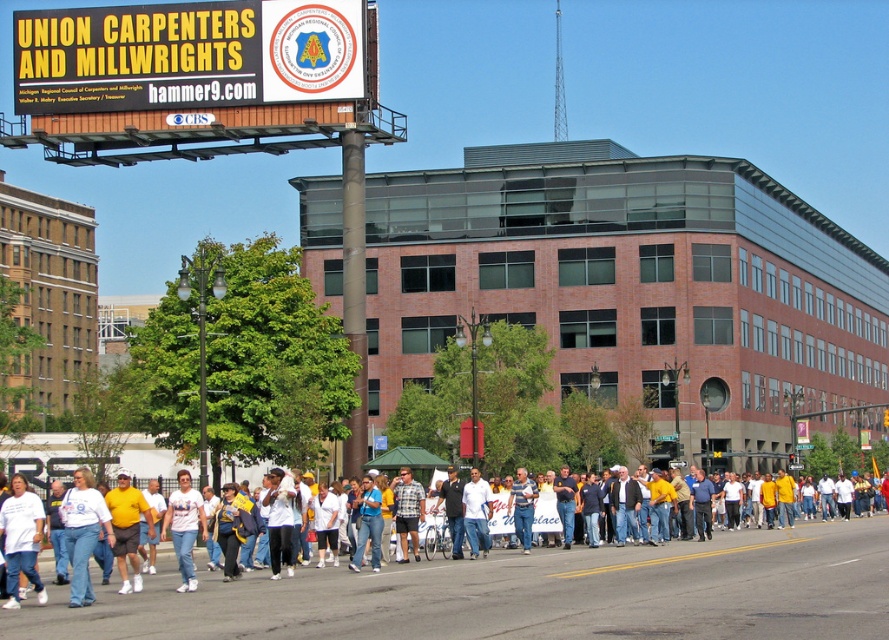
Question: Among these points, which one is nearest to the camera?

Choices:
 (A) (103, 509)
 (B) (795, 579)

Answer: (A)

Question: Among these objects, which one is farthest from the camera?

Choices:
 (A) white cotton shirt at lower left
 (B) yellow t-shirt at center

Answer: (B)

Question: Can you confirm if white cotton t-shirts at center is thinner than blue jeans at center?

Choices:
 (A) no
 (B) yes

Answer: (A)

Question: Which object is positioned closest to the yellow t-shirt at center?

Choices:
 (A) white cotton shirt at center
 (B) white cotton t-shirts at center
 (C) white plastic billboard at upper center

Answer: (A)

Question: Is white plastic billboard at upper center positioned at the back of white cotton shirt at center?

Choices:
 (A) no
 (B) yes

Answer: (B)

Question: Is white cotton t-shirts at center wider than white cotton shirt at lower left?

Choices:
 (A) yes
 (B) no

Answer: (A)